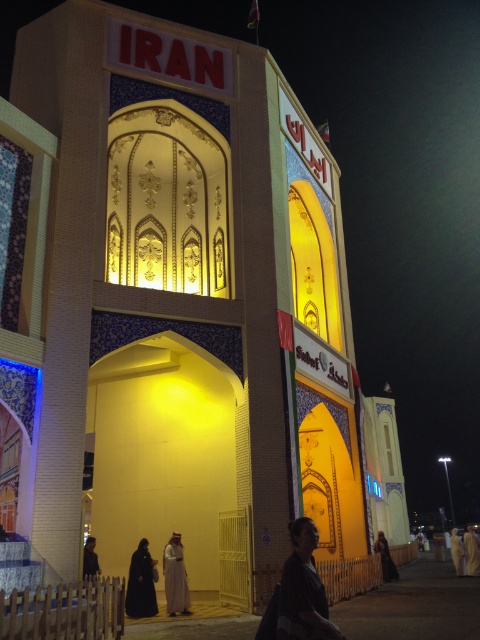
Question: Does dark fabric dress at lower right lie in front of dark fabric person at lower left?

Choices:
 (A) yes
 (B) no

Answer: (B)

Question: Is dark brown leather jacket at lower center further to the viewer compared to dark fabric dress at lower right?

Choices:
 (A) no
 (B) yes

Answer: (A)

Question: Which of the following is the closest to the observer?

Choices:
 (A) dark fabric dress at lower right
 (B) white fabric person at lower right
 (C) black matte dress at lower left

Answer: (C)

Question: Which object is closer to the camera taking this photo?

Choices:
 (A) dark brown leather jacket at lower center
 (B) dark fabric person at lower left
 (C) white clothed person at lower right

Answer: (A)

Question: Which point appears closest to the camera in this image?

Choices:
 (A) (381, 536)
 (B) (136, 598)
 (C) (474, 563)
 (D) (96, 556)

Answer: (B)

Question: Does dark brown leather jacket at lower center have a smaller size compared to white clothed person at lower right?

Choices:
 (A) no
 (B) yes

Answer: (B)